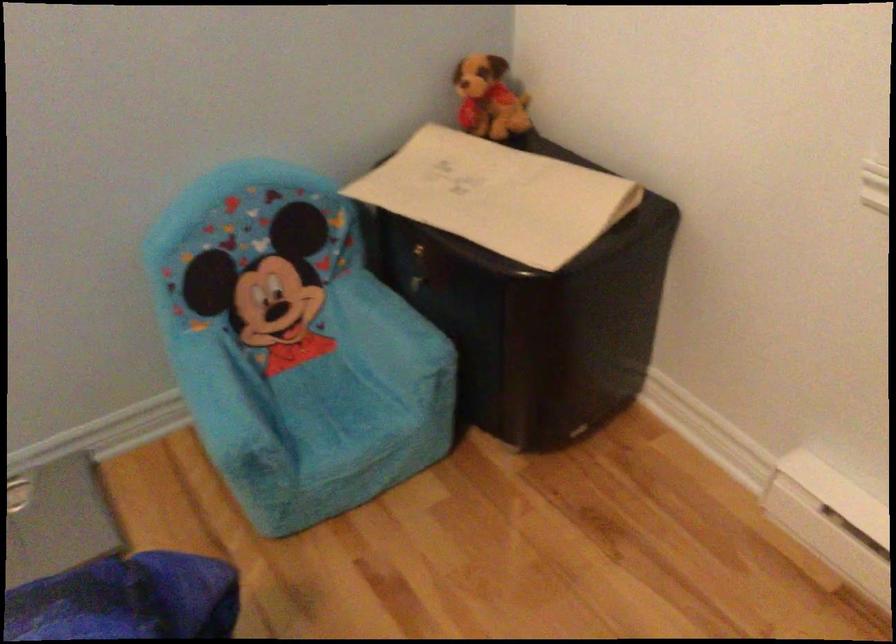
The image size is (896, 644). What do you see at coordinates (364, 402) in the screenshot?
I see `the blue chair sitting surface` at bounding box center [364, 402].